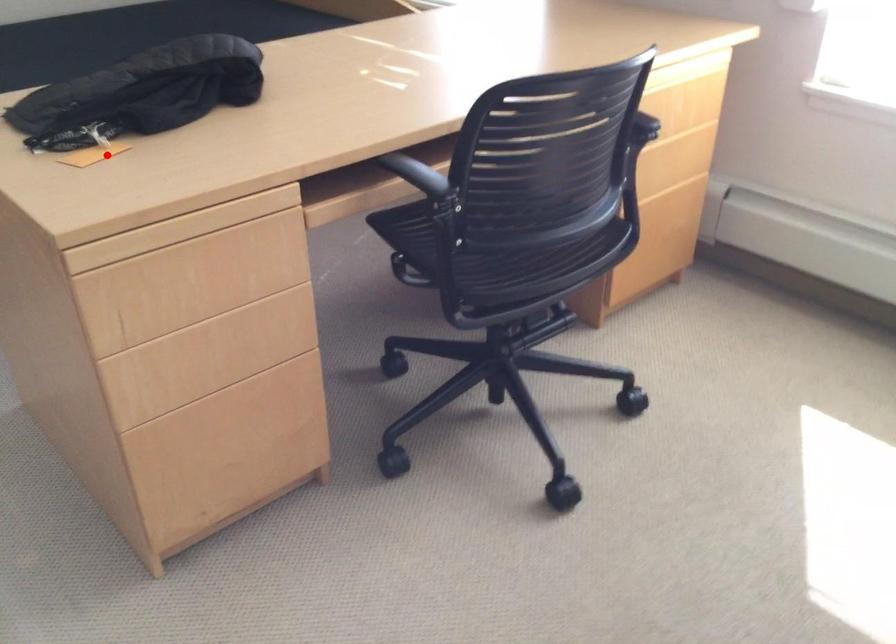
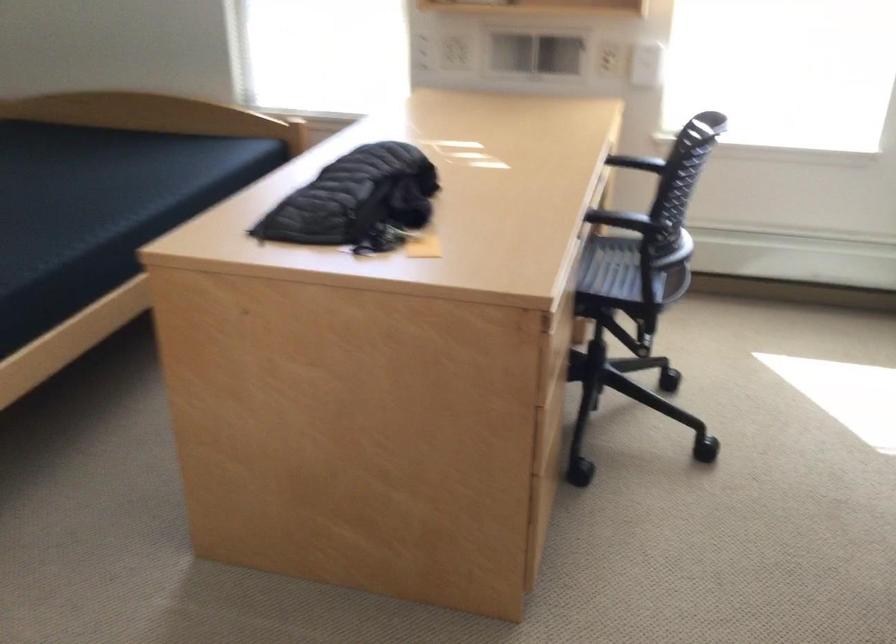
Question: I am providing you with two images of the same scene from different viewpoints. A red point is shown in image1. For the corresponding object point in image2, is it positioned nearer or farther from the camera?

Choices:
 (A) Nearer
 (B) Farther

Answer: (B)